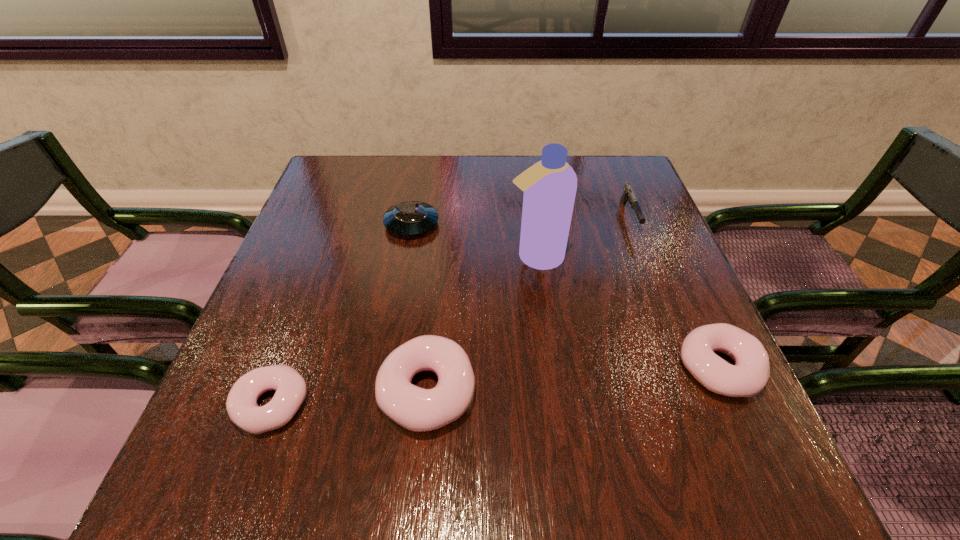
Identify the location of empty space between the second shortest doughnut and the gun. (674, 293).

Image resolution: width=960 pixels, height=540 pixels. I want to click on vacant area that lies between the second doughnut from left to right and the gun, so click(528, 305).

The height and width of the screenshot is (540, 960). What are the coordinates of `free space between the second shortest doughnut and the shampoo` in the screenshot? It's located at (627, 313).

Locate an element on the screen. The width and height of the screenshot is (960, 540). free space between the second shortest doughnut and the shampoo is located at coordinates (627, 313).

This screenshot has height=540, width=960. Find the location of `free spot between the shortest doughnut and the third farthest object`. free spot between the shortest doughnut and the third farthest object is located at coordinates (404, 330).

You are a GUI agent. You are given a task and a screenshot of the screen. Output one action in this format:
    pyautogui.click(x=<x>, y=<y>)
    Task: Click on the vacant region between the leftmost doughnut and the fourth object from left to right
    
    Given the screenshot: What is the action you would take?
    404,330

Choose which object is the third nearest neighbor to the gun. Please provide its 2D coordinates. Your answer should be formatted as a tuple, i.e. [(x, y)], where the tuple contains the x and y coordinates of a point satisfying the conditions above.

[(410, 218)]

At what (x,y) coordinates should I click in order to perform the action: click on object that is the fifth nearest to the saucer. Please return your answer as a coordinate pair (x, y). Looking at the image, I should click on (748, 376).

Choose which doughnut is the nearest neighbor to the second tallest doughnut. Please provide its 2D coordinates. Your answer should be formatted as a tuple, i.e. [(x, y)], where the tuple contains the x and y coordinates of a point satisfying the conditions above.

[(417, 409)]

The width and height of the screenshot is (960, 540). What are the coordinates of `doughnut that is the second closest to the shortest doughnut` in the screenshot? It's located at (748, 376).